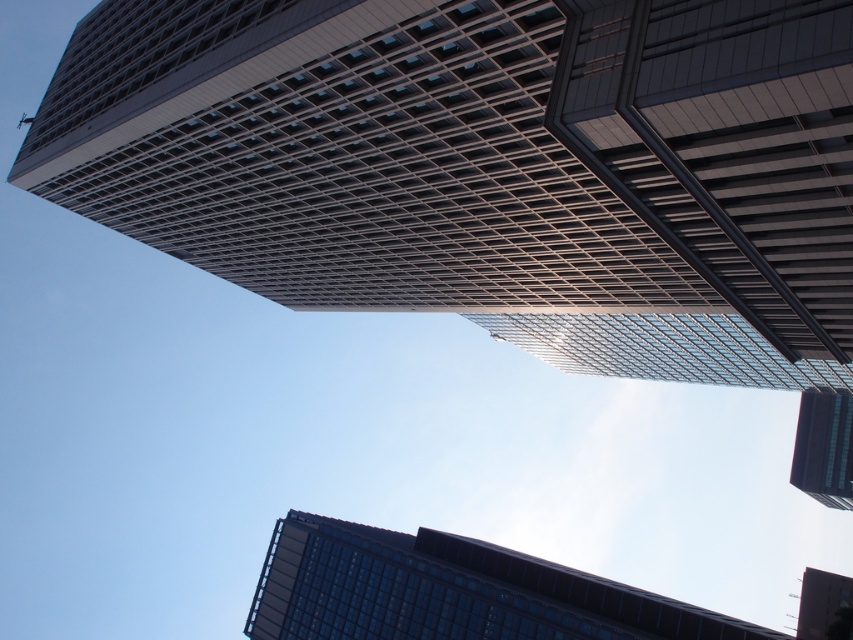
Which of these two, dark glass skyscraper at lower center or glassy reflective tower at upper center, stands shorter?

Standing shorter between the two is glassy reflective tower at upper center.

I want to click on dark glass skyscraper at lower center, so click(x=450, y=592).

Does point (520, 620) come farther from viewer compared to point (848, 588)?

No, (520, 620) is closer to viewer.

Where is `dark glass skyscraper at lower center`? Image resolution: width=853 pixels, height=640 pixels. dark glass skyscraper at lower center is located at coordinates (450, 592).

Between metallic glass skyscraper at upper center and glassy reflective tower at upper center, which one has more height?

metallic glass skyscraper at upper center

Who is more distant from viewer, (445, 308) or (814, 588)?

Positioned behind is point (814, 588).

Who is more distant from viewer, [633,276] or [817,573]?

Positioned behind is point [817,573].

Where is `metallic glass skyscraper at upper center`? The width and height of the screenshot is (853, 640). metallic glass skyscraper at upper center is located at coordinates (490, 168).

Which is behind, point (608, 605) or point (801, 449)?

Point (801, 449)

The height and width of the screenshot is (640, 853). What do you see at coordinates (450, 592) in the screenshot? I see `dark glass skyscraper at lower center` at bounding box center [450, 592].

Measure the distance between point (463, 616) and camera.

Point (463, 616) and camera are 267.56 feet apart from each other.

Where is `dark glass skyscraper at lower center`? The image size is (853, 640). dark glass skyscraper at lower center is located at coordinates (450, 592).